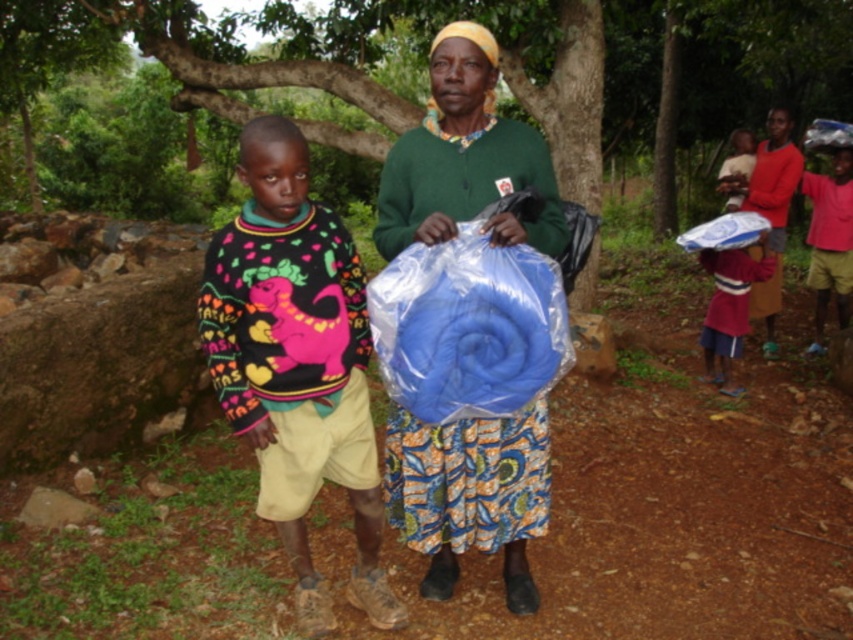
Question: Estimate the real-world distances between objects in this image. Which object is closer to the red cotton shirt at lower right?

Choices:
 (A) matte blue fabric at right
 (B) multicolored sweater at left
 (C) matte pink sweater at upper right
 (D) matte green sweater at center

Answer: (A)

Question: In this image, where is matte green sweater at center located relative to red cotton shirt at lower right?

Choices:
 (A) left
 (B) right

Answer: (A)

Question: Considering the relative positions of red cotton shirt at lower right and matte pink sweater at upper right in the image provided, where is red cotton shirt at lower right located with respect to matte pink sweater at upper right?

Choices:
 (A) right
 (B) left

Answer: (B)

Question: Is matte green sweater at center to the right of matte pink sweater at upper right from the viewer's perspective?

Choices:
 (A) yes
 (B) no

Answer: (B)

Question: Which of the following is the farthest from the observer?

Choices:
 (A) (798, 163)
 (B) (730, 180)
 (C) (416, 221)
 (D) (730, 305)

Answer: (B)

Question: Among these points, which one is farthest from the camera?

Choices:
 (A) (779, 138)
 (B) (727, 173)

Answer: (B)